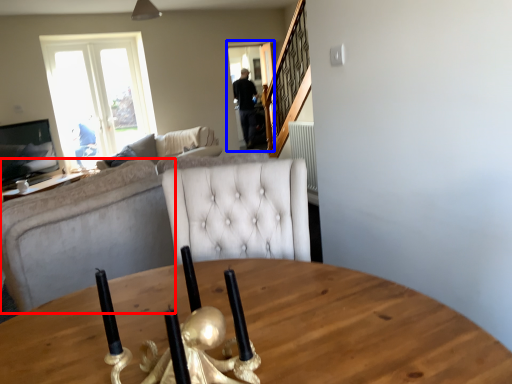
Question: Which point is closer to the camera, studio couch (highlighted by a red box) or glass door (highlighted by a blue box)?

Choices:
 (A) studio couch
 (B) glass door

Answer: (A)